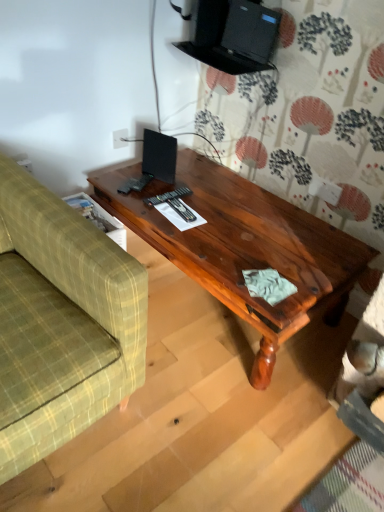
Question: Considering the positions of shiny brown wood coffee table at center and green plaid fabric couch at left in the image, is shiny brown wood coffee table at center bigger or smaller than green plaid fabric couch at left?

Choices:
 (A) big
 (B) small

Answer: (B)

Question: Is point (243, 180) positioned closer to the camera than point (79, 234)?

Choices:
 (A) closer
 (B) farther

Answer: (B)

Question: Visually, is shiny brown wood coffee table at center positioned to the left or to the right of green plaid fabric couch at left?

Choices:
 (A) right
 (B) left

Answer: (A)

Question: Is green plaid fabric couch at left taller or shorter than shiny brown wood coffee table at center?

Choices:
 (A) tall
 (B) short

Answer: (A)

Question: In the image, is green plaid fabric couch at left positioned in front of or behind shiny brown wood coffee table at center?

Choices:
 (A) front
 (B) behind

Answer: (A)

Question: Is point 79,261 closer or farther from the camera than point 137,232?

Choices:
 (A) farther
 (B) closer

Answer: (B)

Question: Would you say green plaid fabric couch at left is to the left or to the right of shiny brown wood coffee table at center in the picture?

Choices:
 (A) right
 (B) left

Answer: (B)